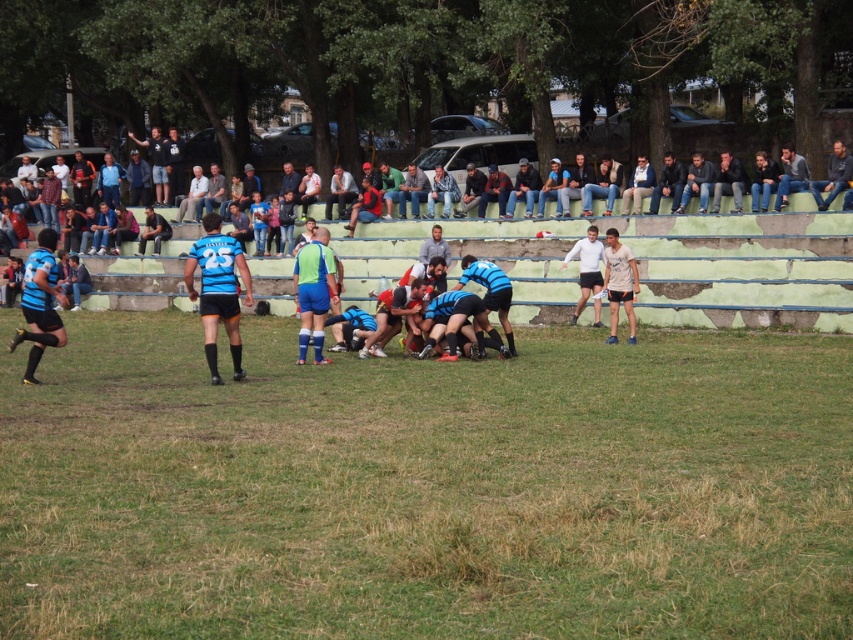
You are a referee at a rugby match and need to locate the blue fabric rugby player at center. What are the coordinates where you can find them?

The blue fabric rugby player at center is located at coordinates point (312, 291).

You are a referee observing a rugby scrum. You notice two players at the center of the scrum. One is wearing a blue fabric rugby player at center and the other has a light brown fabric shirt at center. Which player appears bigger in size?

The blue fabric rugby player at center is larger in size than the light brown fabric shirt at center, so the player in blue appears bigger.

You are a photographer at the rugby match and want to capture a closeup of the light brown fabric shirt at center and the jeans at upper right. Which clothing item is narrower when viewed from your position?

The light brown fabric shirt at center is thinner than jeans at upper right, so the light brown fabric shirt at center is narrower.